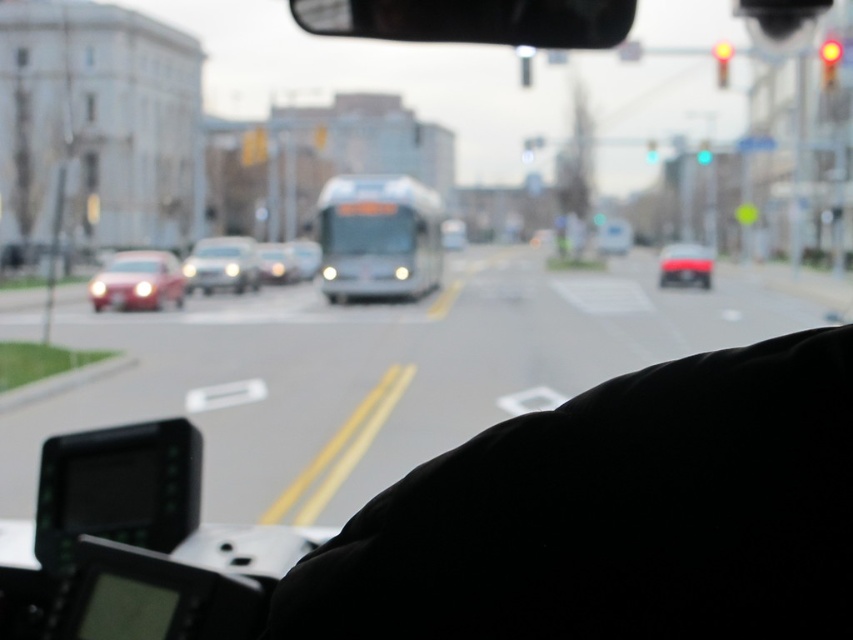
Who is taller, matte red car at center or red glass traffic light at upper center?

With more height is matte red car at center.

From the picture: Does matte red car at center have a larger size compared to red glass traffic light at upper center?

Indeed, matte red car at center has a larger size compared to red glass traffic light at upper center.

Where is `matte red car at center`? The height and width of the screenshot is (640, 853). matte red car at center is located at coordinates (685, 264).

Can you confirm if matte red car at left is positioned to the left of red glass traffic light at upper right?

Indeed, matte red car at left is positioned on the left side of red glass traffic light at upper right.

Can you confirm if matte red car at left is positioned to the right of red glass traffic light at upper right?

In fact, matte red car at left is to the left of red glass traffic light at upper right.

What do you see at coordinates (138, 282) in the screenshot?
I see `matte red car at left` at bounding box center [138, 282].

This screenshot has width=853, height=640. Find the location of `matte red car at left`. matte red car at left is located at coordinates (138, 282).

Is matte silver sedan at center shorter than metallic silver bus at center?

Indeed, matte silver sedan at center has a lesser height compared to metallic silver bus at center.

In order to click on matte silver sedan at center in this screenshot , I will do `click(276, 262)`.

Is point (289, 252) less distant than point (297, 259)?

That is True.

The image size is (853, 640). In order to click on matte silver sedan at center in this screenshot , I will do tap(276, 262).